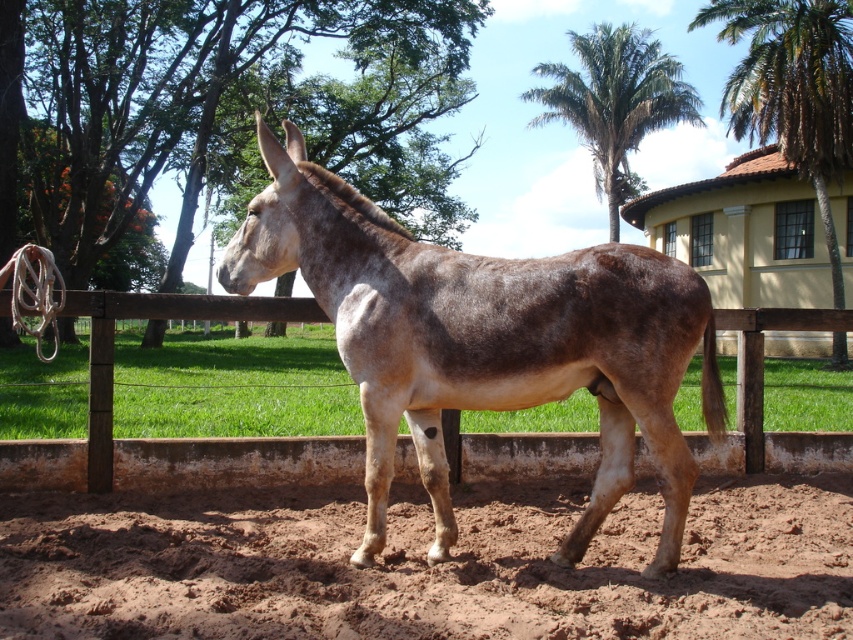
In the scene shown: Is brown sandy soil at lower center bigger than green leafy palm at upper center?

No, brown sandy soil at lower center is not bigger than green leafy palm at upper center.

Is brown sandy soil at lower center closer to camera compared to green leafy palm at upper center?

That is True.

The image size is (853, 640). What are the coordinates of `brown sandy soil at lower center` in the screenshot? It's located at (427, 566).

This screenshot has width=853, height=640. I want to click on brown sandy soil at lower center, so click(427, 566).

Who is higher up, green leafy palm tree at upper right or green leafy palm at upper center?

green leafy palm at upper center is above.

Is point (767, 60) less distant than point (616, 106)?

Yes, point (767, 60) is closer to viewer.

Image resolution: width=853 pixels, height=640 pixels. I want to click on green leafy palm tree at upper right, so click(793, 90).

Between brown speckled fur at center and brown wooden fence at center, which one is positioned higher?

Positioned higher is brown wooden fence at center.

Does brown speckled fur at center have a greater width compared to brown wooden fence at center?

Yes, brown speckled fur at center is wider than brown wooden fence at center.

Between point (663, 339) and point (798, 312), which one is positioned in front?

Point (663, 339)

At what (x,y) coordinates should I click in order to perform the action: click on brown speckled fur at center. Please return your answer as a coordinate pair (x, y). This screenshot has height=640, width=853. Looking at the image, I should click on (485, 339).